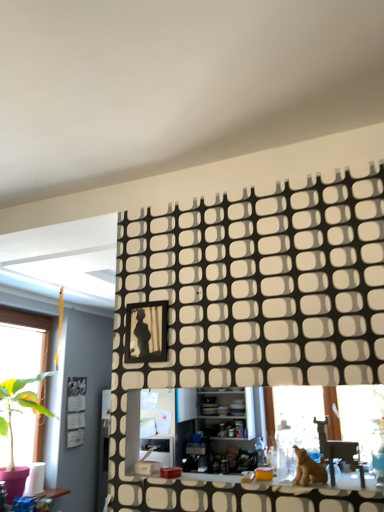
This screenshot has height=512, width=384. In order to click on vacant space situated above black textured wall panel at upper center (from a real-world perspective) in this screenshot , I will do `click(230, 184)`.